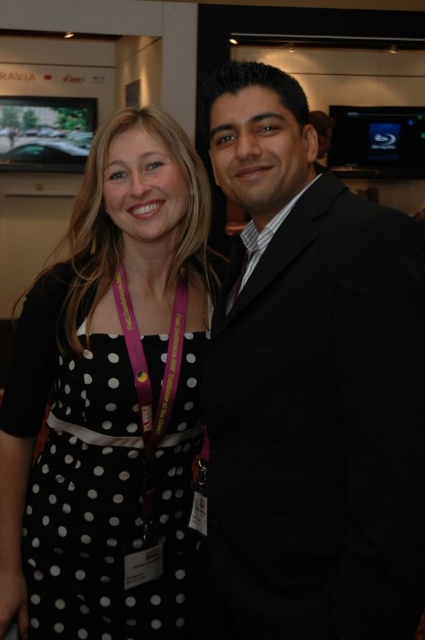
Question: Is black polka dot dress at center bigger than pink fabric lanyard at center?

Choices:
 (A) no
 (B) yes

Answer: (B)

Question: Which of the following is the farthest from the observer?

Choices:
 (A) black dotted dress at center
 (B) black polka dot dress at center
 (C) pink fabric lanyard at center
 (D) black suit at right

Answer: (C)

Question: In this image, where is black polka dot dress at center located relative to pink fabric lanyard at center?

Choices:
 (A) above
 (B) below

Answer: (A)

Question: Can you confirm if black suit at right is smaller than pink fabric lanyard at center?

Choices:
 (A) no
 (B) yes

Answer: (A)

Question: Which object is farther from the camera taking this photo?

Choices:
 (A) black suit at right
 (B) black dotted dress at center

Answer: (B)

Question: Based on their relative distances, which object is farther from the black dotted dress at center?

Choices:
 (A) black suit at right
 (B) black polka dot dress at center
 (C) pink fabric lanyard at center

Answer: (A)